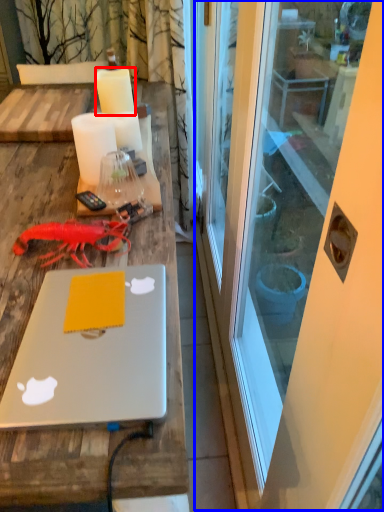
Question: Which point is closer to the camera, candle (highlighted by a red box) or screen door (highlighted by a blue box)?

Choices:
 (A) candle
 (B) screen door

Answer: (B)